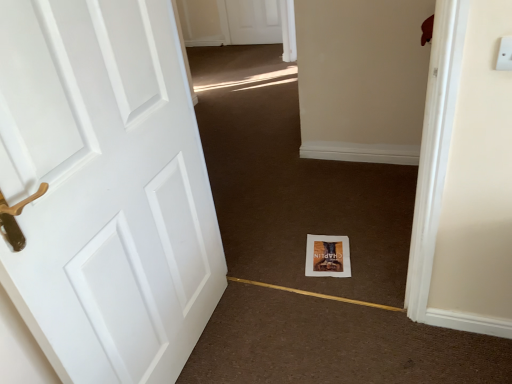
You are a GUI agent. You are given a task and a screenshot of the screen. Output one action in this format:
    pyautogui.click(x=<x>, y=<y>)
    Task: Click on the vacant space situated on the left part of matte paper book at center
    The height and width of the screenshot is (384, 512).
    Given the screenshot: What is the action you would take?
    pyautogui.click(x=285, y=263)